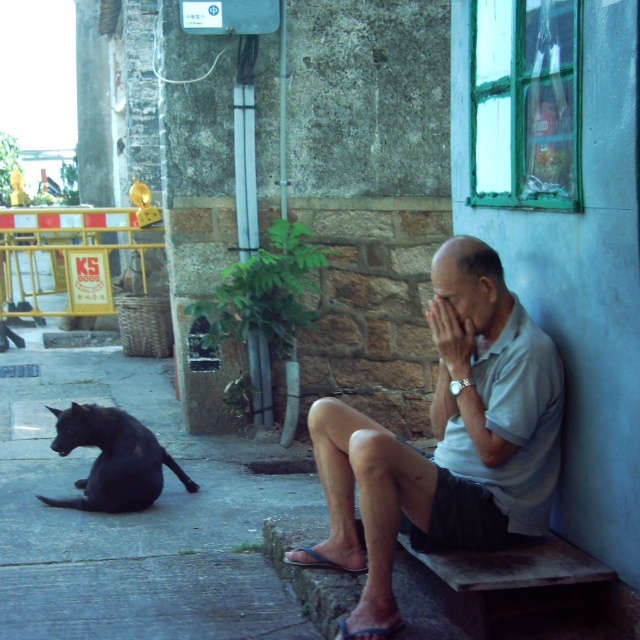
You are a photographer trying to capture both the light gray cotton shirt at center and the shiny black cat at lower left in a single frame. Considering their sizes, which object should you focus on first to ensure both are in the frame?

The light gray cotton shirt at center is larger than the shiny black cat at lower left, so you should focus on framing the larger object first to ensure both fit in the shot.